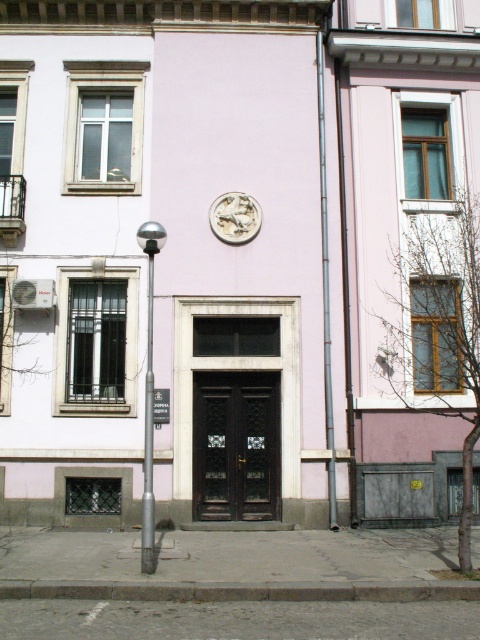
Question: Which point is closer to the camera?

Choices:
 (A) silver metallic pole at left
 (B) silver metallic coin at center

Answer: (A)

Question: Does metallic gray pipe at center have a greater width compared to white plastic sign at center?

Choices:
 (A) no
 (B) yes

Answer: (A)

Question: Is metallic gray pipe at center positioned behind white plastic sign at center?

Choices:
 (A) yes
 (B) no

Answer: (B)

Question: Which point is closer to the camera taking this photo?

Choices:
 (A) (321, 93)
 (B) (148, 308)
 (C) (243, 196)
 (D) (166, 401)

Answer: (D)

Question: Is metallic gray pipe at center positioned at the back of metallic silver pole at center?

Choices:
 (A) no
 (B) yes

Answer: (B)

Question: Among these objects, which one is nearest to the camera?

Choices:
 (A) white plastic sign at center
 (B) metallic silver pole at center
 (C) silver metallic coin at center
 (D) metallic gray pipe at center

Answer: (B)